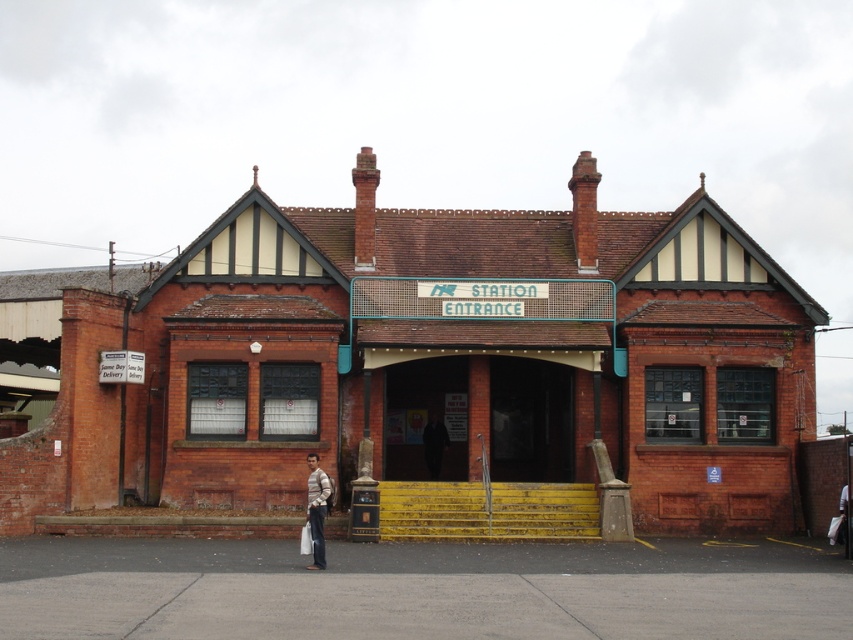
Who is taller, brick building at center or dark brown leather jacket at center?

brick building at center is taller.

Which of these two, brick building at center or dark brown leather jacket at center, stands shorter?

dark brown leather jacket at center

Which is in front, point (527, 237) or point (436, 422)?

Point (436, 422) is in front.

This screenshot has height=640, width=853. I want to click on brick building at center, so click(x=422, y=358).

Which is more to the left, brick building at center or striped sweater at lower left?

striped sweater at lower left

Between point (44, 349) and point (321, 548), which one is positioned behind?

Point (44, 349)

Where is `brick building at center`? brick building at center is located at coordinates (422, 358).

Based on the photo, between striped sweater at lower left and dark brown leather jacket at center, which one is positioned higher?

Positioned higher is striped sweater at lower left.

Does striped sweater at lower left have a greater height compared to dark brown leather jacket at center?

Indeed, striped sweater at lower left has a greater height compared to dark brown leather jacket at center.

Is point (310, 470) positioned before point (439, 422)?

Yes, point (310, 470) is closer to viewer.

Find the location of a particular element. The height and width of the screenshot is (640, 853). striped sweater at lower left is located at coordinates (317, 508).